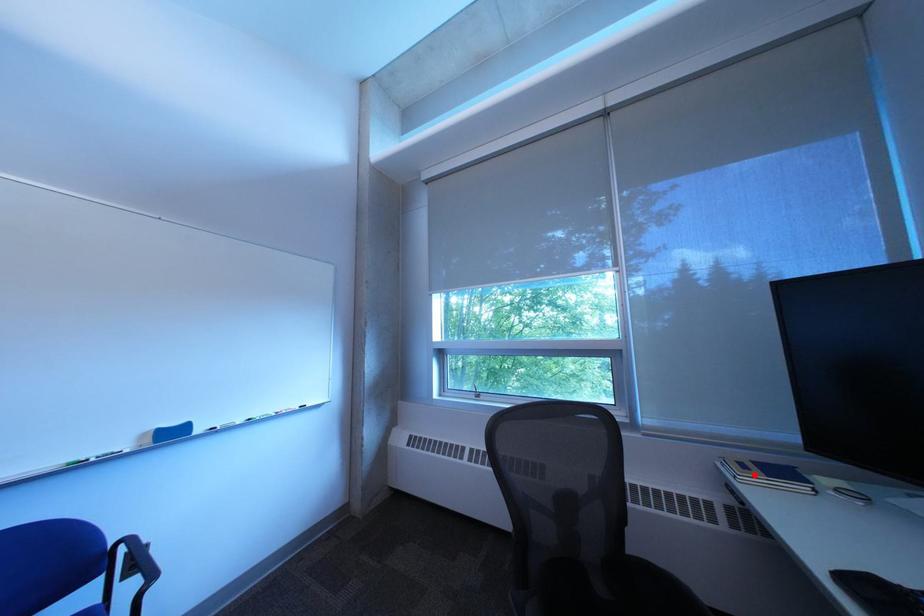
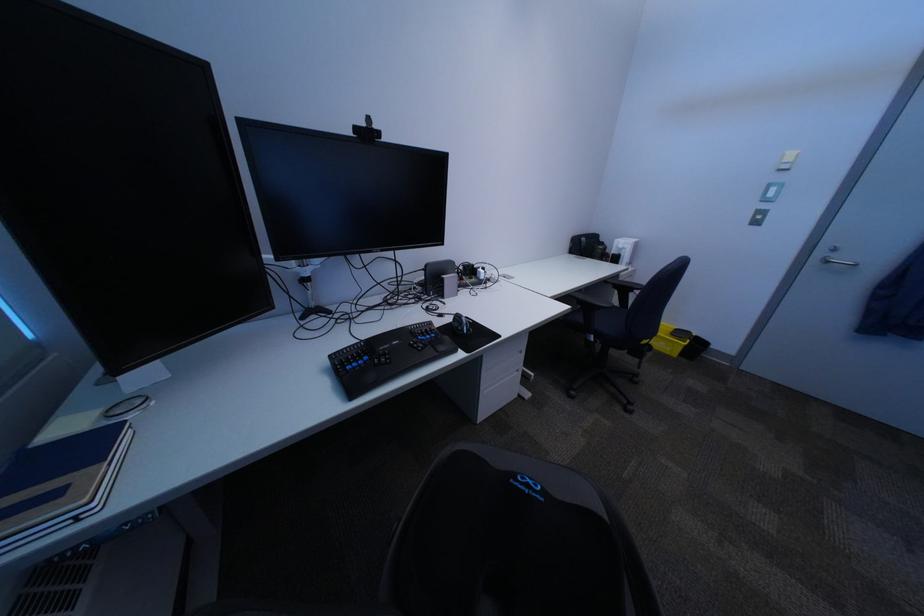
Locate, in the second image, the point that corresponds to the highlighted location in the first image.

(101, 503)